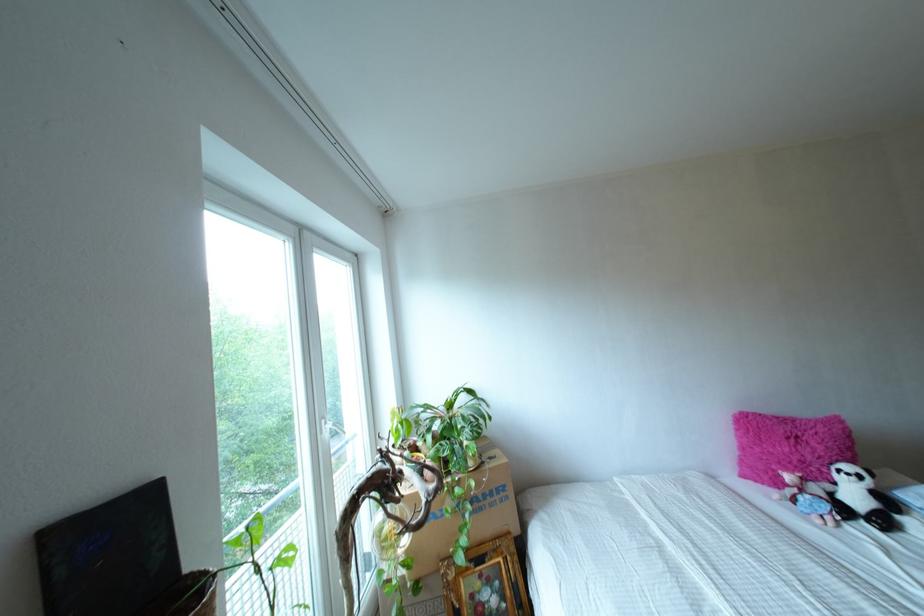
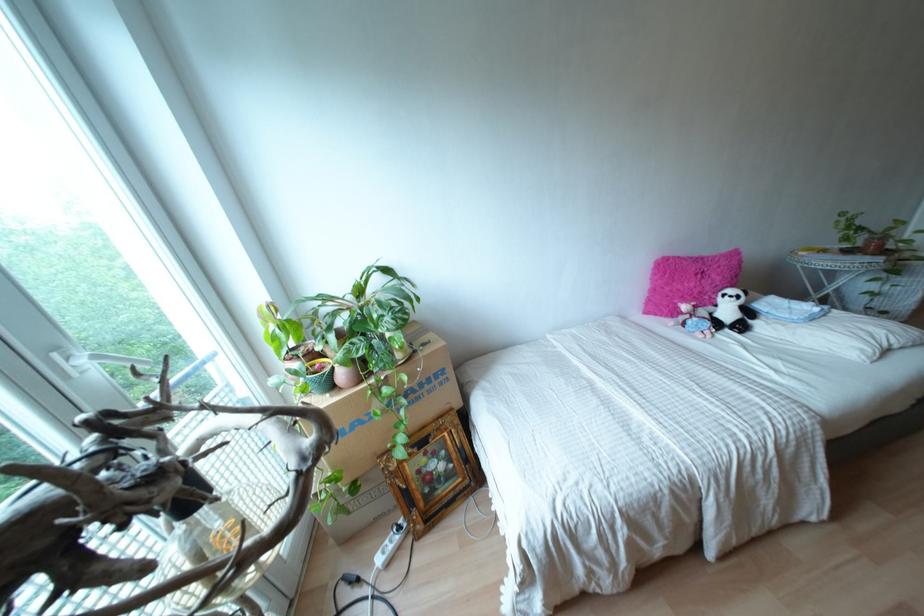
Locate, in the second image, the point that corresponds to [888,501] in the first image.

(747, 312)